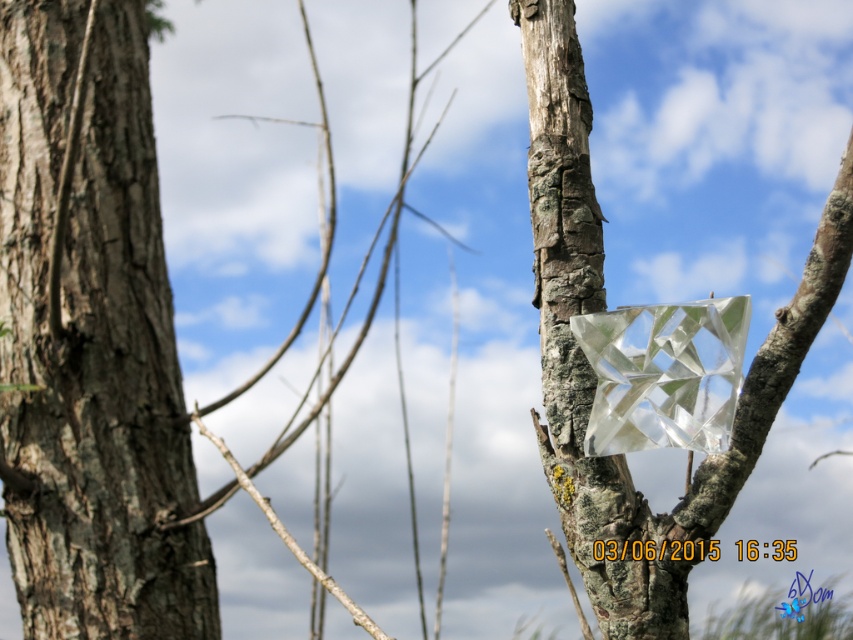
You are an artist sketching the scene. You need to decide which object to draw first based on their sizes. Which one should you start with, the rough bark tree trunk at left or the transparent glass cube at center?

The rough bark tree trunk at left is taller than the transparent glass cube at center, so you should start with the rough bark tree trunk at left since it is larger in height.

Based on the scene description, where is the rough bark tree trunk at left located in terms of its 2D coordinates?

The rough bark tree trunk at left is located at the 2D coordinates of point (91, 342).